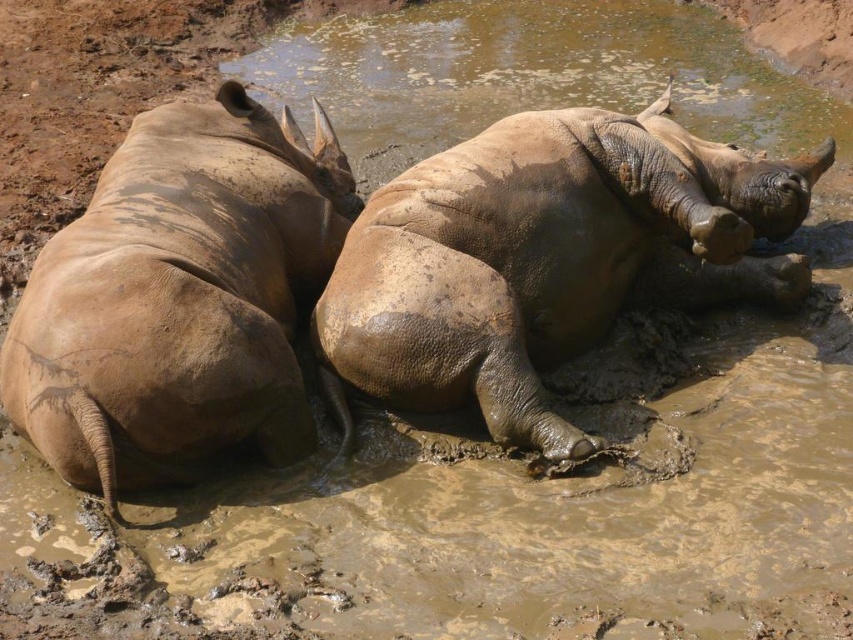
You are a wildlife photographer aiming to capture a closeup of both the dull brown rhinoceros at center and the dull brown rhino at left. Since you want to ensure both are in frame, which rhino is positioned to the right side of the other?

The dull brown rhinoceros at center is positioned to the right of the dull brown rhino at left.

You are a wildlife photographer aiming to capture a closeup of the rhinos. You have a camera with a 50mm lens that can focus on subjects up to 3 meters away. If you are standing 2 meters away from the dull brown rhinoceros at center, can you also capture the dull brown rhino at left in the same frame without moving your position?

The dull brown rhinoceros at center is larger than the dull brown rhino at left. Since you are 2 meters away from the center rhino, your camera can focus up to 3 meters, so the left rhino must be within that range. However, the question is about whether they can be in the same frame. Since both are in the same waterhole and the center rhino is larger, it suggests they are relatively close. Assuming the left rhino is within 3 meters, yes, but the exact distance isn not specified. The answer should use the g.

You are a wildlife photographer aiming to capture a closeup of the dull brown rhinoceros at center. You are currently positioned at the point marked by coordinates point (546,259). Is this the best position to get a clear view of the rhinoceros?

The point (546,259) marks the dull brown rhinoceros at center, so you are already positioned directly at the rhinoceros, making it the best position to capture a clear closeup.